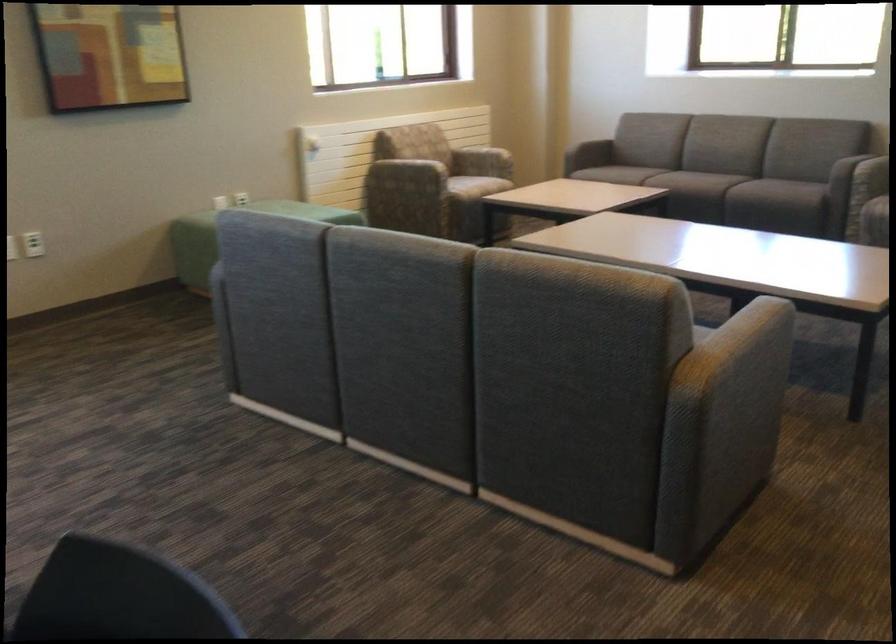
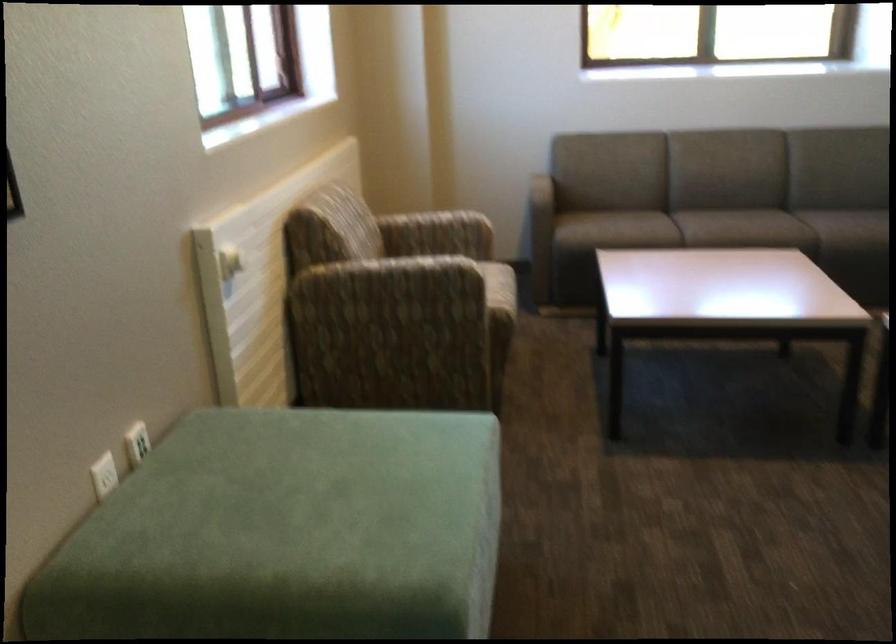
In the second image, find the point that corresponds to pixel 693 178 in the first image.

(780, 229)